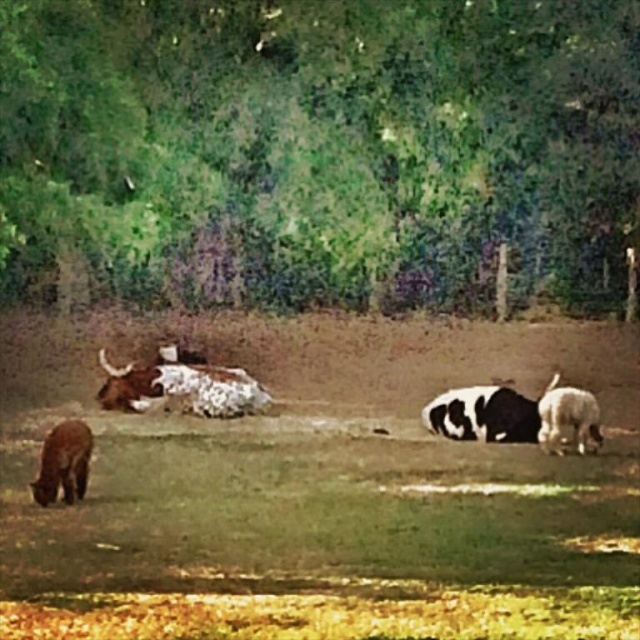
Question: Based on their relative distances, which object is farther from the black and white fur at center?

Choices:
 (A) white woolly sheep at lower right
 (B) green leafy tree at upper center
 (C) brown furry dog at lower left

Answer: (B)

Question: Does brown furry dog at lower left appear on the left side of white woolly sheep at lower right?

Choices:
 (A) no
 (B) yes

Answer: (B)

Question: Does brown furry dog at lower left lie in front of white woolly sheep at lower right?

Choices:
 (A) yes
 (B) no

Answer: (A)

Question: Is black and white fur at center further to the viewer compared to brown furry dog at lower left?

Choices:
 (A) no
 (B) yes

Answer: (B)

Question: Which object is positioned farthest from the green leafy tree at upper center?

Choices:
 (A) brown furry dog at lower left
 (B) white woolly sheep at lower right

Answer: (A)

Question: Which of the following is the farthest from the observer?

Choices:
 (A) (412, 224)
 (B) (580, 445)
 (C) (38, 476)
 (D) (476, 422)

Answer: (A)